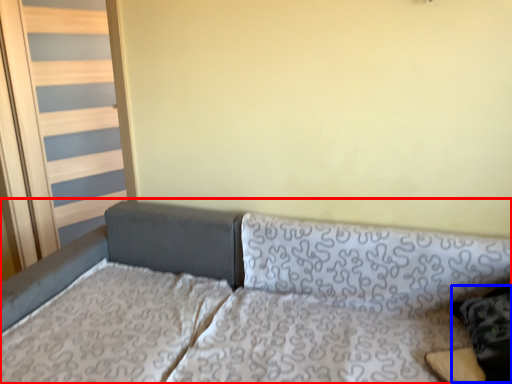
Question: Which point is further to the camera, studio couch (highlighted by a red box) or pillow (highlighted by a blue box)?

Choices:
 (A) studio couch
 (B) pillow

Answer: (B)